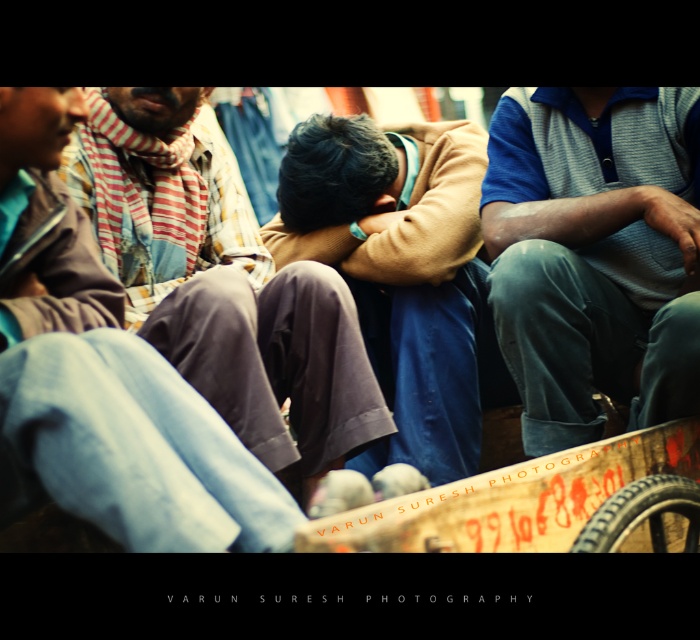
Question: Which is farther from the brown woolen sweater at center?

Choices:
 (A) blue striped polo shirt at center
 (B) brown cotton shirt at center

Answer: (A)

Question: Which point appears closest to the camera in this image?

Choices:
 (A) (435, 376)
 (B) (244, 438)

Answer: (B)

Question: Which point is farther to the camera?

Choices:
 (A) brown woolen sweater at center
 (B) brown cotton shirt at center

Answer: (A)

Question: Is blue striped polo shirt at center above brown cotton shirt at center?

Choices:
 (A) no
 (B) yes

Answer: (A)

Question: Does blue striped polo shirt at center have a greater width compared to brown woolen sweater at center?

Choices:
 (A) no
 (B) yes

Answer: (A)

Question: Observing the image, what is the correct spatial positioning of blue striped polo shirt at center in reference to brown woolen sweater at center?

Choices:
 (A) below
 (B) above

Answer: (A)